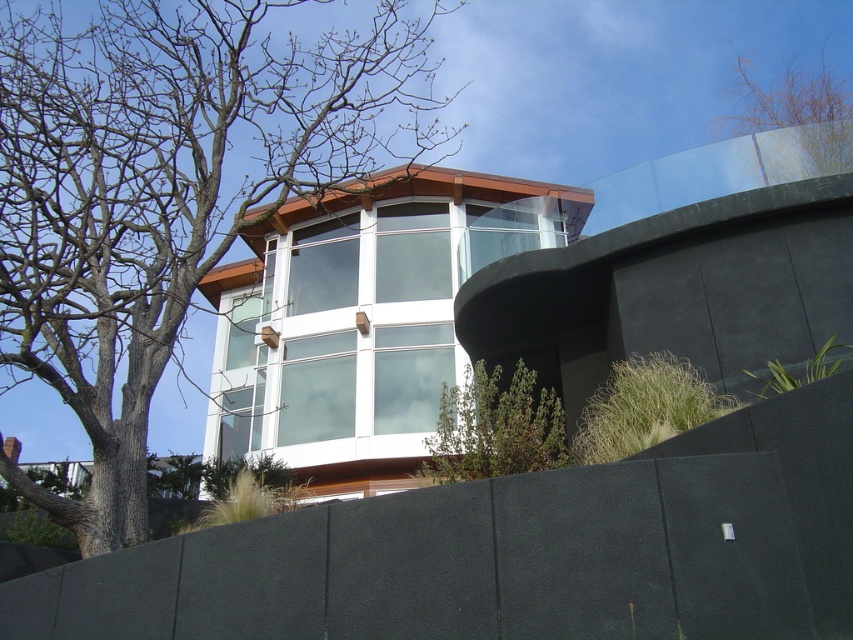
You are standing at the base of the slope in front of the modern building. You see a brown leafless tree at left and a green leafy shrub at lower center. Which of these two plants is positioned higher up the slope?

The brown leafless tree at left is located above the green leafy shrub at lower center, so it is positioned higher up the slope.

You are standing at the base of the slope looking up at the building. You notice the brown leafless tree at left and the clear glass windows at center. Which object is positioned higher up the slope?

The brown leafless tree at left is located above the clear glass windows at center, so it is positioned higher up the slope.